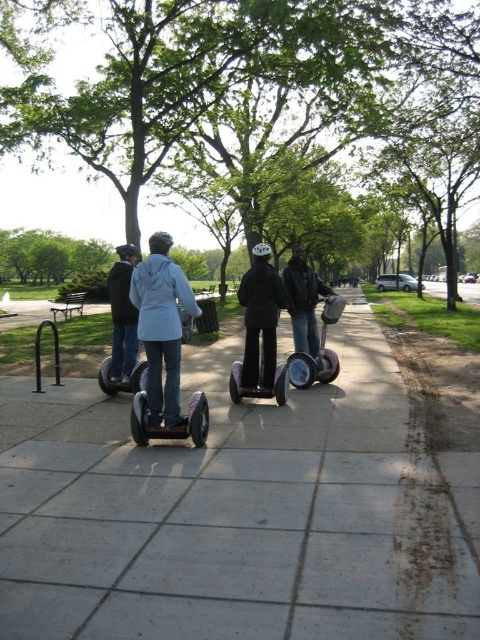
You are standing at the point with coordinates (x=162, y=326) in the park. What object is exactly at this point?

The light blue fabric jacket at center is located at point (x=162, y=326).

You are a photographer positioned at the park pathway. You see the light blue fabric jacket at center and the black leather jacket at center. Which rider should you follow to capture the one on the right side of the group?

The black leather jacket at center is on the right side of the group, so you should follow the rider wearing the black leather jacket at center to capture the one on the right side of the group.